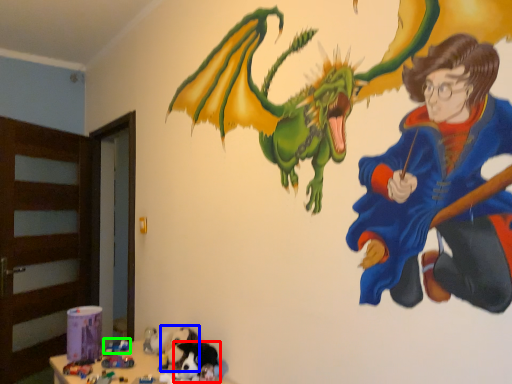
Question: Considering the real-world distances, which object is closest to animal (highlighted by a red box)? animal (highlighted by a blue box) or toy (highlighted by a green box).

Choices:
 (A) animal
 (B) toy

Answer: (A)